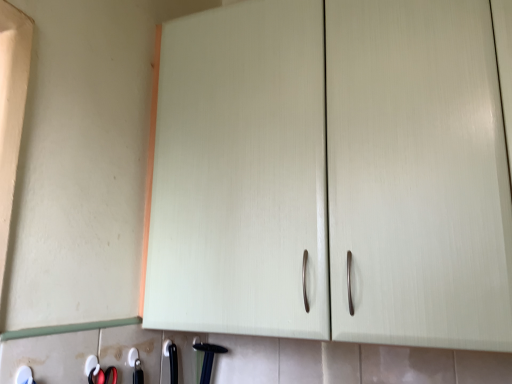
Question: Is the depth of black plastic hammer at lower center less than that of white plastic tool at lower left?

Choices:
 (A) yes
 (B) no

Answer: (B)

Question: From the image's perspective, does black plastic hammer at lower center appear higher than white plastic tool at lower left?

Choices:
 (A) no
 (B) yes

Answer: (A)

Question: Is black plastic hammer at lower center positioned with its back to white plastic tool at lower left?

Choices:
 (A) no
 (B) yes

Answer: (A)

Question: Considering the relative sizes of black plastic hammer at lower center and white plastic tool at lower left in the image provided, is black plastic hammer at lower center bigger than white plastic tool at lower left?

Choices:
 (A) no
 (B) yes

Answer: (B)

Question: Is black plastic hammer at lower center not inside white plastic tool at lower left?

Choices:
 (A) yes
 (B) no

Answer: (A)

Question: From a real-world perspective, is black plastic hammer at lower center beneath white plastic tool at lower left?

Choices:
 (A) no
 (B) yes

Answer: (B)

Question: From a real-world perspective, is white plastic tool at lower left over black plastic hammer at lower center?

Choices:
 (A) no
 (B) yes

Answer: (B)

Question: Is white plastic tool at lower left smaller than black plastic hammer at lower center?

Choices:
 (A) yes
 (B) no

Answer: (A)

Question: Can you confirm if white plastic tool at lower left is taller than black plastic hammer at lower center?

Choices:
 (A) yes
 (B) no

Answer: (B)

Question: Is white plastic tool at lower left in front of black plastic hammer at lower center?

Choices:
 (A) yes
 (B) no

Answer: (A)

Question: Is white plastic tool at lower left next to black plastic hammer at lower center?

Choices:
 (A) yes
 (B) no

Answer: (B)

Question: From the image's perspective, would you say white plastic tool at lower left is positioned over black plastic hammer at lower center?

Choices:
 (A) yes
 (B) no

Answer: (A)

Question: Considering the positions of black plastic hammer at lower center and white plastic tool at lower left in the image, is black plastic hammer at lower center taller or shorter than white plastic tool at lower left?

Choices:
 (A) short
 (B) tall

Answer: (B)